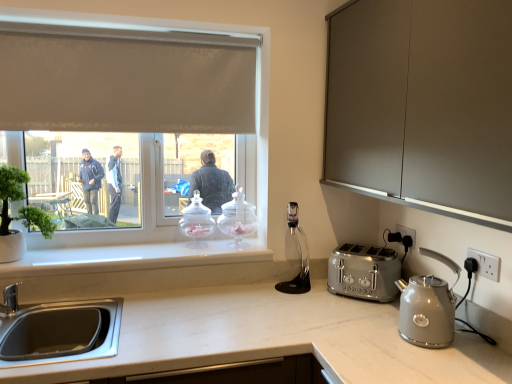
At what (x,y) coordinates should I click in order to perform the action: click on free spot above white glossy window sill at lower center (from a real-world perspective). Please return your answer as a coordinate pair (x, y). This screenshot has height=384, width=512. Looking at the image, I should click on (x=123, y=249).